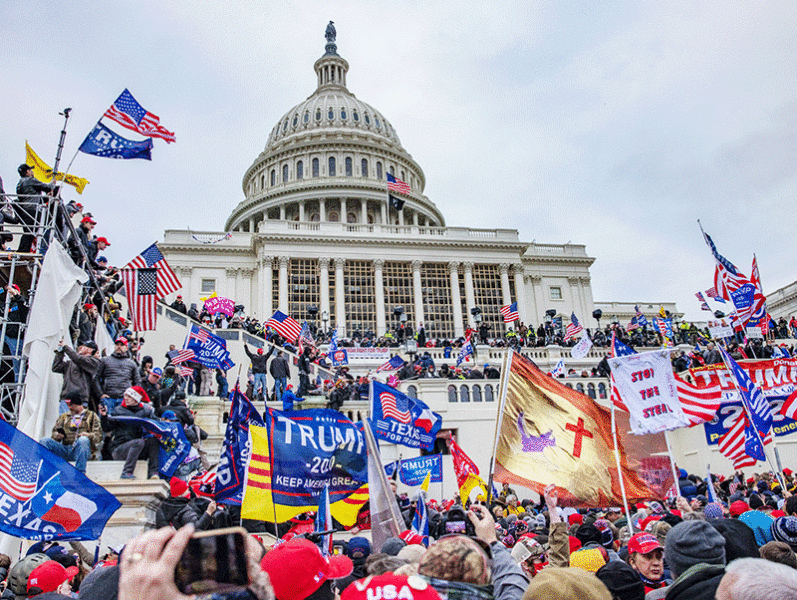
Locate an element on the screen. The width and height of the screenshot is (797, 600). columns is located at coordinates (468, 278), (456, 310), (418, 301), (379, 304), (336, 289), (324, 291), (285, 283), (503, 284).